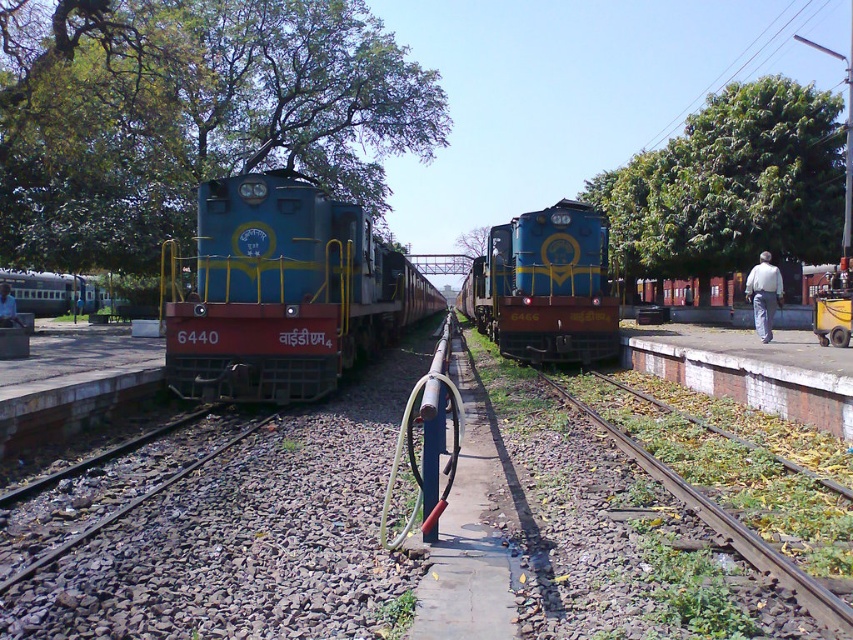
Question: Based on their relative distances, which object is nearer to the green grassy track at lower right?

Choices:
 (A) brown gravel train track at center
 (B) matte blue train at center
 (C) blue glossy locomotive at center
 (D) green matte train at left

Answer: (A)

Question: Observing the image, what is the correct spatial positioning of matte blue train at center in reference to green grassy track at lower right?

Choices:
 (A) above
 (B) below

Answer: (A)

Question: Which point appears farthest from the camera in this image?

Choices:
 (A) (601, 246)
 (B) (55, 275)

Answer: (B)

Question: Can you confirm if matte blue train at center is bigger than brown gravel train track at center?

Choices:
 (A) yes
 (B) no

Answer: (A)

Question: Can you confirm if matte blue train at center is smaller than blue glossy locomotive at center?

Choices:
 (A) no
 (B) yes

Answer: (B)

Question: Which of these objects is positioned closest to the green matte train at left?

Choices:
 (A) blue glossy locomotive at center
 (B) brown gravel train track at center
 (C) green grassy track at lower right
 (D) matte blue train at center

Answer: (D)